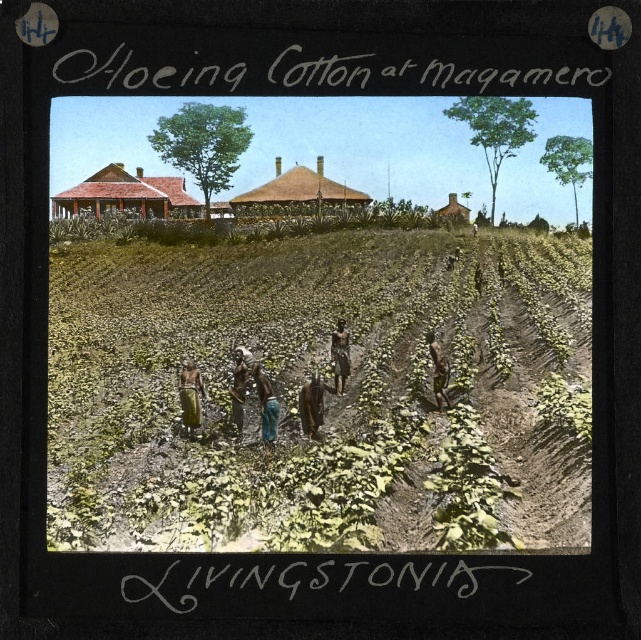
Based on the scene description, where is the brown fabric at center located in the image?

The brown fabric at center is located at the central part of the image, specifically at the coordinates point (338, 356).